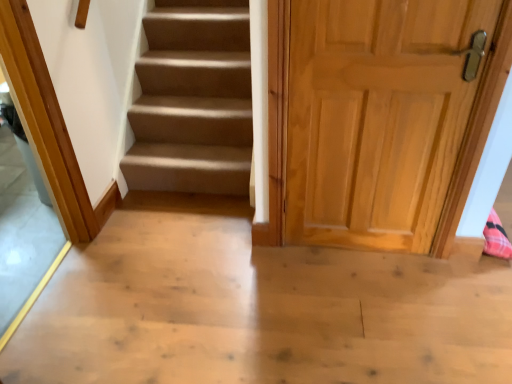
Question: From the image's perspective, is transparent glass door at left under light brown wood door at right?

Choices:
 (A) yes
 (B) no

Answer: (A)

Question: Is transparent glass door at left positioned with its back to light brown wood door at right?

Choices:
 (A) no
 (B) yes

Answer: (A)

Question: Is transparent glass door at left not near light brown wood door at right?

Choices:
 (A) no
 (B) yes

Answer: (B)

Question: Is transparent glass door at left thinner than light brown wood door at right?

Choices:
 (A) no
 (B) yes

Answer: (A)

Question: Can you confirm if transparent glass door at left is shorter than light brown wood door at right?

Choices:
 (A) yes
 (B) no

Answer: (B)

Question: From a real-world perspective, is transparent glass door at left on light brown wood door at right?

Choices:
 (A) yes
 (B) no

Answer: (A)

Question: Is light brown wood door at right aimed at transparent glass door at left?

Choices:
 (A) no
 (B) yes

Answer: (A)

Question: From the image's perspective, is light brown wood door at right over transparent glass door at left?

Choices:
 (A) no
 (B) yes

Answer: (B)

Question: Is transparent glass door at left located within light brown wood door at right?

Choices:
 (A) no
 (B) yes

Answer: (A)

Question: From a real-world perspective, is light brown wood door at right under transparent glass door at left?

Choices:
 (A) no
 (B) yes

Answer: (B)

Question: Is light brown wood door at right far from transparent glass door at left?

Choices:
 (A) no
 (B) yes

Answer: (B)

Question: Is light brown wood door at right positioned before transparent glass door at left?

Choices:
 (A) no
 (B) yes

Answer: (A)

Question: From the image's perspective, is light brown wood door at right above or below transparent glass door at left?

Choices:
 (A) below
 (B) above

Answer: (B)